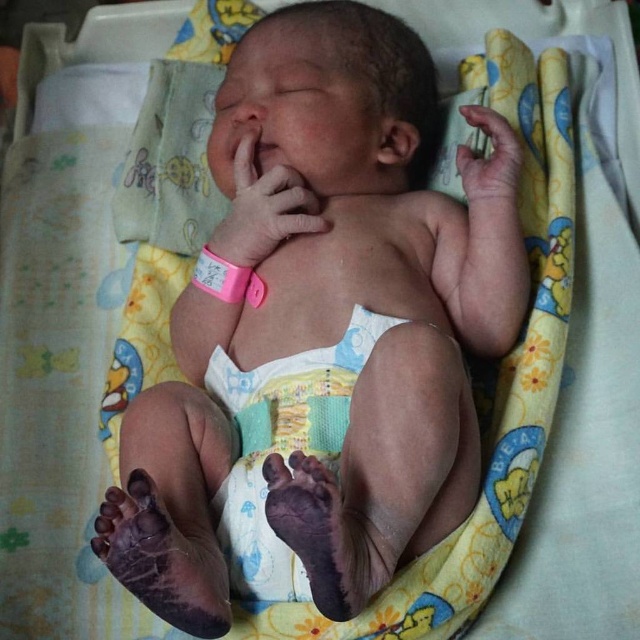
Is smooth white bib at center taller than smooth skin hand at upper right?

Yes.

Image resolution: width=640 pixels, height=640 pixels. I want to click on smooth white bib at center, so click(284, 444).

Does point (224, 372) come closer to viewer compared to point (476, 192)?

No, it is not.

Where is `smooth white bib at center`? The height and width of the screenshot is (640, 640). smooth white bib at center is located at coordinates (284, 444).

Between pink rubber band at center and smooth skin hand at upper right, which one appears on the left side from the viewer's perspective?

pink rubber band at center

Which is above, pink rubber band at center or smooth skin hand at upper right?

Positioned higher is smooth skin hand at upper right.

Where is `pink rubber band at center`? pink rubber band at center is located at coordinates (264, 209).

Based on the photo, can you confirm if smooth white bib at center is smaller than pink rubber band at center?

No, smooth white bib at center is not smaller than pink rubber band at center.

Does smooth white bib at center have a greater width compared to pink rubber band at center?

Correct, the width of smooth white bib at center exceeds that of pink rubber band at center.

The height and width of the screenshot is (640, 640). In order to click on smooth white bib at center in this screenshot , I will do `click(284, 444)`.

Where is `smooth white bib at center`? This screenshot has width=640, height=640. smooth white bib at center is located at coordinates [284, 444].